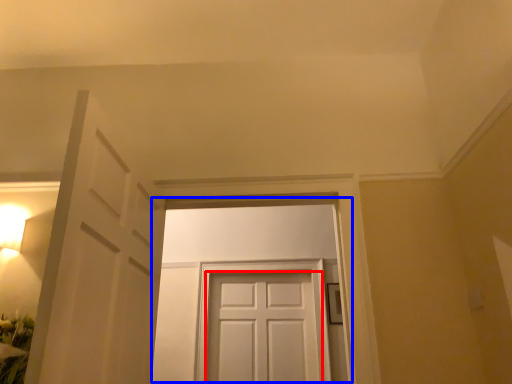
Question: Among these objects, which one is nearest to the camera, door (highlighted by a red box) or door (highlighted by a blue box)?

Choices:
 (A) door
 (B) door

Answer: (B)